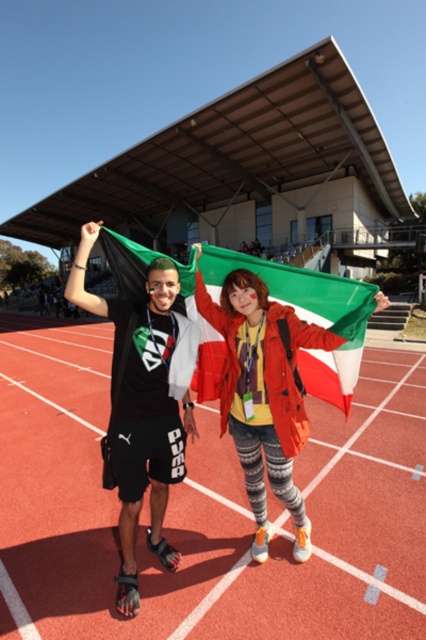
Question: Which of the following is the closest to the observer?

Choices:
 (A) (233, 256)
 (B) (160, 412)
 (C) (328, 352)
 (D) (290, 396)

Answer: (D)

Question: Can you confirm if matte black shorts at left is wider than black matte t-shirt at center?

Choices:
 (A) no
 (B) yes

Answer: (B)

Question: Which point appears closest to the camera in this image?

Choices:
 (A) (267, 470)
 (B) (138, 262)

Answer: (B)

Question: Can you confirm if matte black shorts at left is positioned above black matte t-shirt at center?

Choices:
 (A) no
 (B) yes

Answer: (A)

Question: Can you confirm if matte green flag at center is thinner than black matte t-shirt at center?

Choices:
 (A) yes
 (B) no

Answer: (B)

Question: Which point is closer to the camera?

Choices:
 (A) matte black shorts at left
 (B) greenmaterial/textureflag at center
 (C) black matte t-shirt at center
 (D) matte green flag at center

Answer: (A)